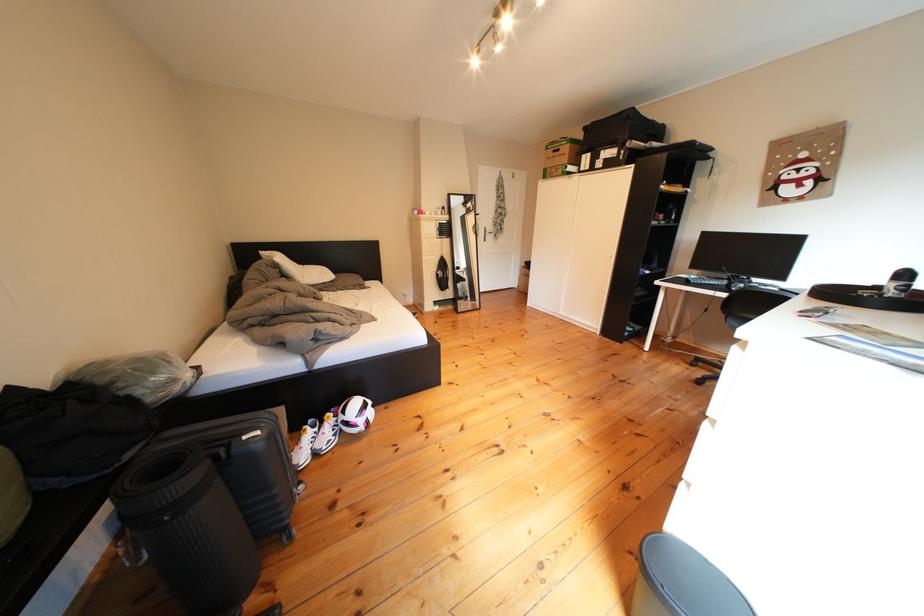
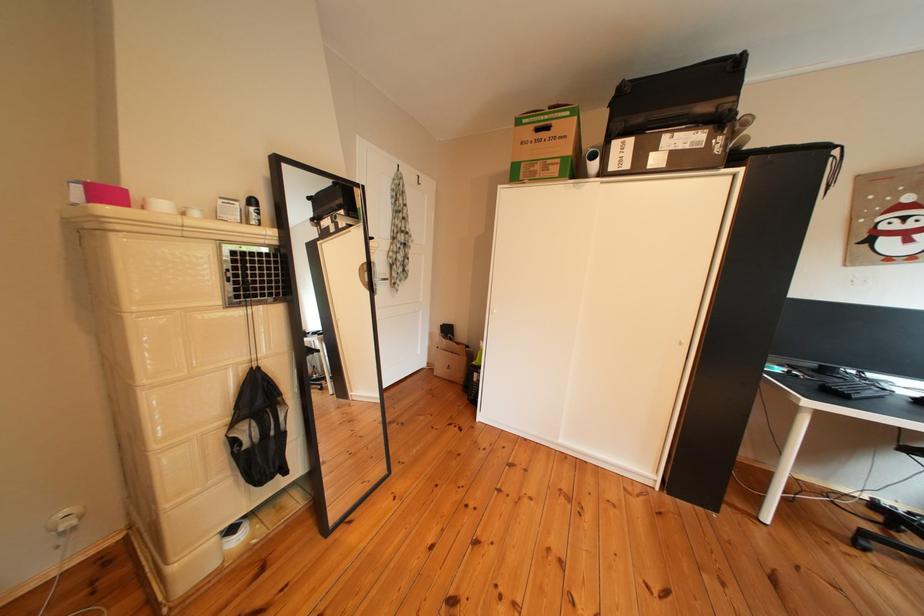
Locate, in the second image, the point that corresponds to point 452,280 in the first image.

(249, 447)